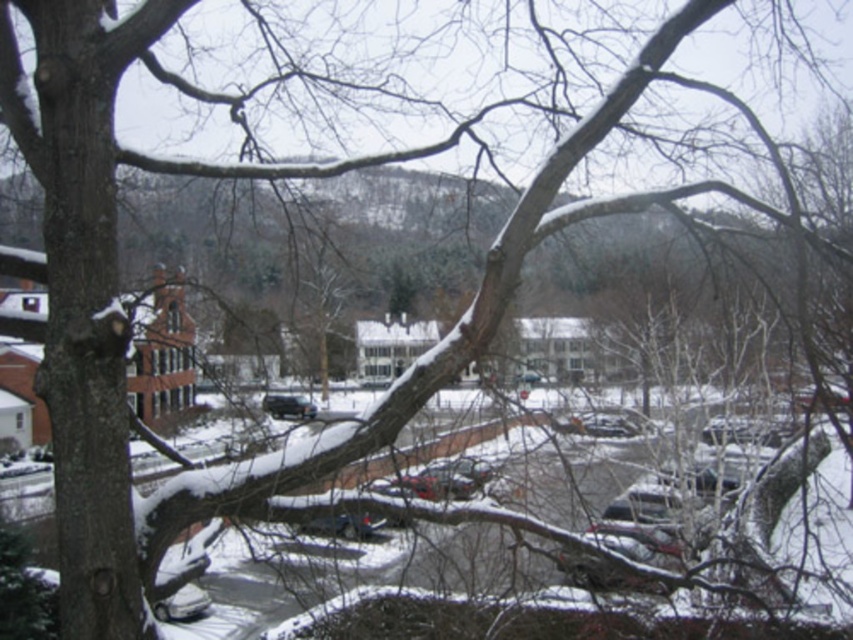
You are standing in the parking lot and want to get to the satin black car at center. There is a metallic silver car at lower left in your way. Which car should you move around to reach your destination?

You should move around the metallic silver car at lower left since it is closer to you and blocking the path to the satin black car at center.

You are standing at the center of the parking lot and see the metallic silver car at lower left and the satin black car at center. Which car is positioned more to the right side of the parking lot?

The metallic silver car at lower left is positioned more to the right side of the parking lot because it is located to the right of the satin black car at center.

You are a delivery person needing to park your van between the metallic silver car at lower left and the satin black car at center. The van is 7 meters long. Can you safely park your van in this space without overlapping either car?

The distance between the metallic silver car at lower left and the satin black car at center is 32.45 meters. Since the van is only 7 meters long, there is sufficient space to park it between them without overlapping either vehicle.